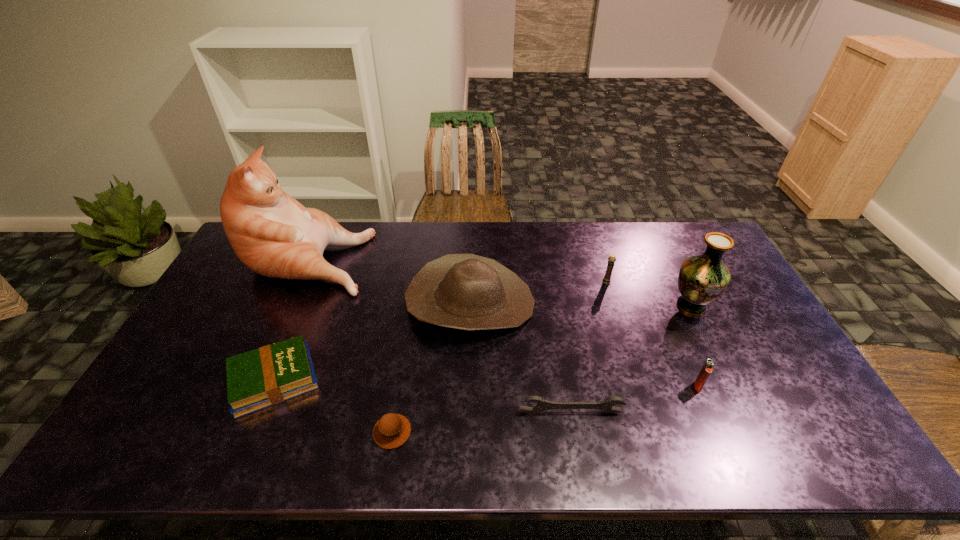
Point out which object is positioned as the second nearest to the fifth tallest object. Please provide its 2D coordinates. Your answer should be formatted as a tuple, i.e. [(x, y)], where the tuple contains the x and y coordinates of a point satisfying the conditions above.

[(607, 405)]

I want to click on object that stands as the closest to the fourth tallest object, so pos(702,279).

The height and width of the screenshot is (540, 960). In order to click on free space that satisfies the following two spatial constraints: 1. on the face of the cat; 2. on the left side of the sixth object from left to right in this screenshot , I will do `click(299, 281)`.

Where is `vacant region that satisfies the following two spatial constraints: 1. on the face of the muffin; 2. on the right side of the cat`? vacant region that satisfies the following two spatial constraints: 1. on the face of the muffin; 2. on the right side of the cat is located at coordinates (231, 432).

The image size is (960, 540). Identify the location of free space that satisfies the following two spatial constraints: 1. on the face of the book; 2. on the left side of the cat. (254, 379).

The height and width of the screenshot is (540, 960). Find the location of `vacant space that satisfies the following two spatial constraints: 1. on the face of the third tallest object; 2. on the right side of the tallest object`. vacant space that satisfies the following two spatial constraints: 1. on the face of the third tallest object; 2. on the right side of the tallest object is located at coordinates (289, 303).